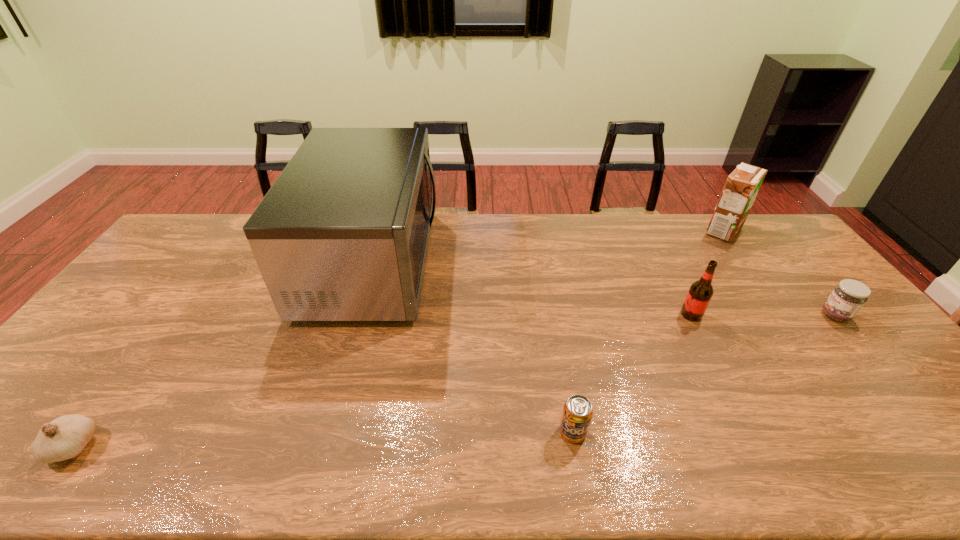
I want to click on carton that is at the far edge, so click(742, 186).

Where is `soda can located at the near edge`? The image size is (960, 540). soda can located at the near edge is located at coordinates (577, 413).

Identify the location of garlic situated at the near edge. This screenshot has height=540, width=960. (65, 437).

The height and width of the screenshot is (540, 960). I want to click on object at the left edge, so click(65, 437).

What are the coordinates of `carton that is at the right edge` in the screenshot? It's located at (742, 186).

Find the location of a particular element. The width and height of the screenshot is (960, 540). jam located at the right edge is located at coordinates (848, 297).

This screenshot has height=540, width=960. Identify the location of object that is at the near left corner. [65, 437].

What are the coordinates of `object located at the far right corner` in the screenshot? It's located at (742, 186).

The height and width of the screenshot is (540, 960). In the image, there is a desktop. Find the location of `free space at the far edge`. free space at the far edge is located at coordinates (561, 242).

The image size is (960, 540). In the image, there is a desktop. Identify the location of free space at the near edge. (788, 441).